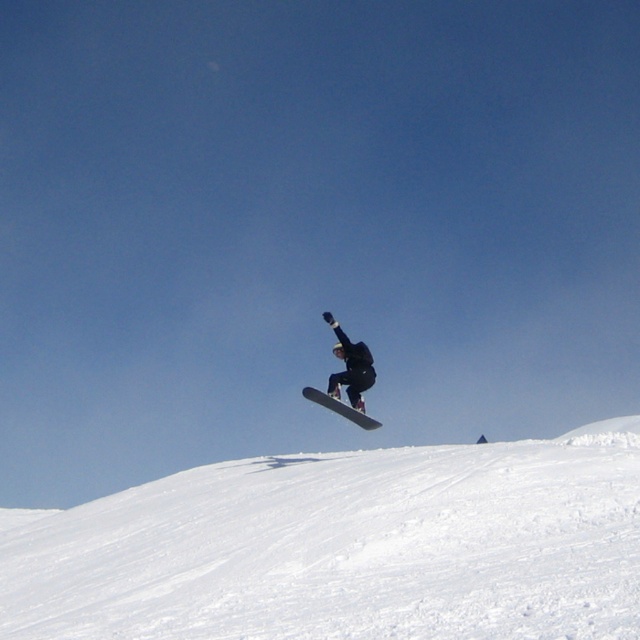
Question: Which point is farther to the camera?

Choices:
 (A) white matte snowboard at center
 (B) white powdery snow at lower left

Answer: (A)

Question: Can you confirm if white powdery snow at lower left is wider than black matte snowboarder at center?

Choices:
 (A) yes
 (B) no

Answer: (A)

Question: Is white powdery snow at lower left positioned at the back of white matte snowboard at center?

Choices:
 (A) yes
 (B) no

Answer: (B)

Question: Which of the following is the closest to the observer?

Choices:
 (A) white powdery snow at lower left
 (B) black matte snowboarder at center
 (C) white matte snowboard at center

Answer: (A)

Question: Which object is closer to the camera taking this photo?

Choices:
 (A) white matte snowboard at center
 (B) white powdery snow at lower left

Answer: (B)

Question: Does white powdery snow at lower left appear on the left side of white matte snowboard at center?

Choices:
 (A) no
 (B) yes

Answer: (B)